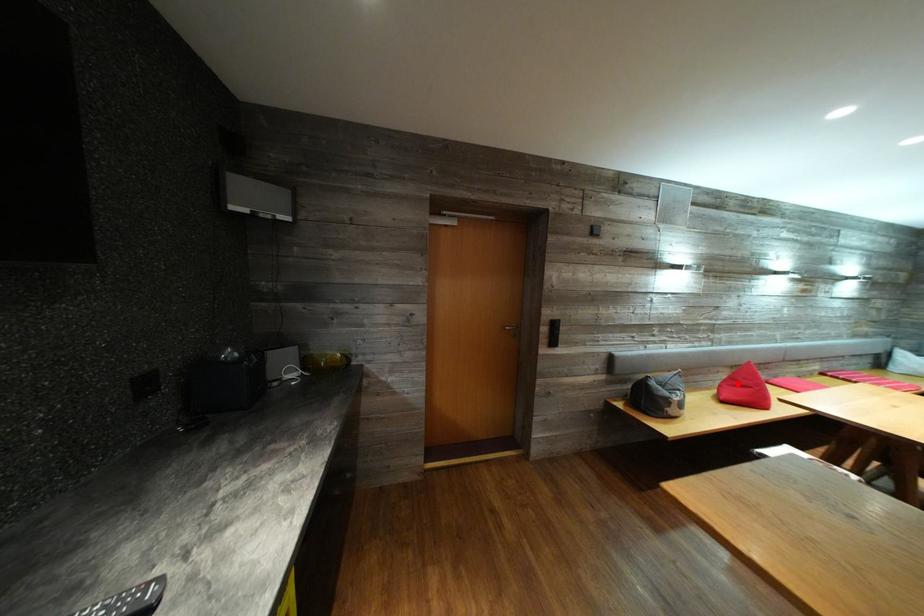
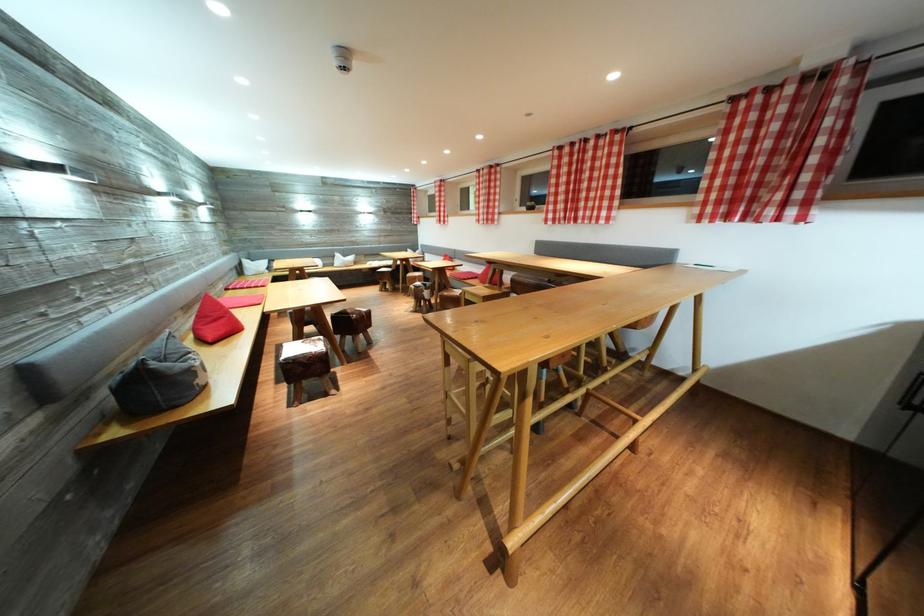
The point at the highlighted location is marked in the first image. Where is the corresponding point in the second image?

(207, 323)